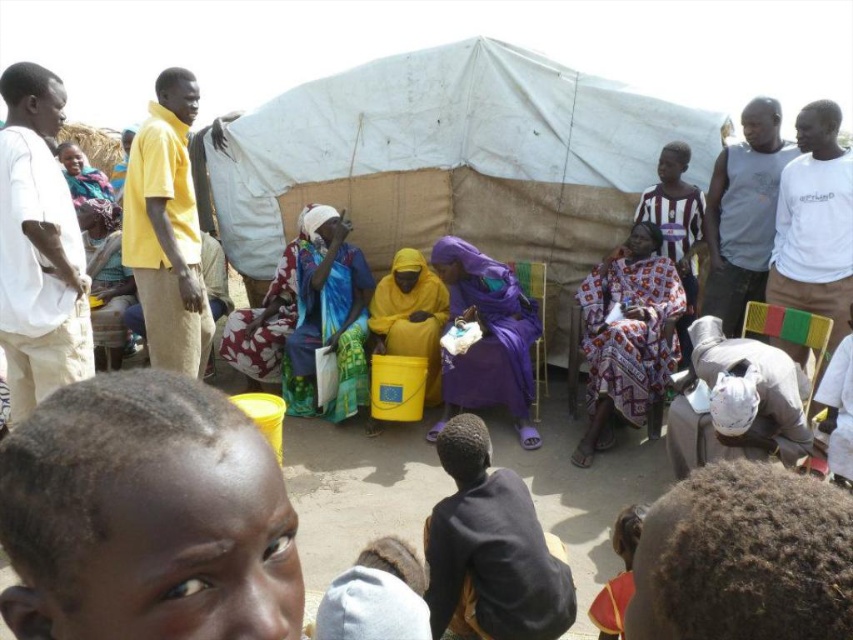
Question: Which object is the closest to the printed fabric dress at center?

Choices:
 (A) green and yellow striped chair at lower right
 (B) yellow fabric dress at center
 (C) yellow matte plastic bucket at center

Answer: (A)

Question: Is yellow matte plastic bucket at center behind green and yellow striped chair at lower right?

Choices:
 (A) no
 (B) yes

Answer: (B)

Question: Which point is closer to the camera?

Choices:
 (A) (399, 314)
 (B) (457, 244)
 (C) (595, 364)
 (D) (587, 170)

Answer: (C)

Question: Can you confirm if printed fabric dress at center is thinner than green and yellow striped chair at lower right?

Choices:
 (A) no
 (B) yes

Answer: (A)

Question: Which object is closer to the camera taking this photo?

Choices:
 (A) yellow fabric dress at center
 (B) green and yellow striped chair at lower right

Answer: (B)

Question: Can you confirm if purple fabric at center is thinner than yellow matte plastic bucket at center?

Choices:
 (A) yes
 (B) no

Answer: (B)